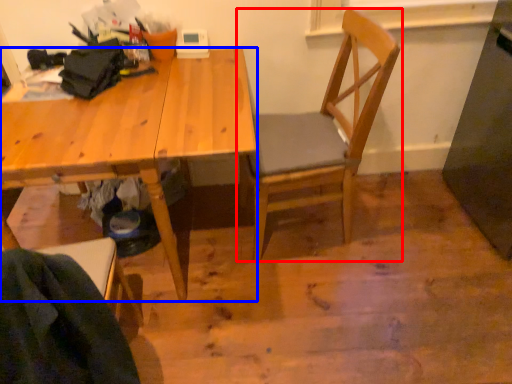
Question: Among these objects, which one is nearest to the camera, chair (highlighted by a red box) or desk (highlighted by a blue box)?

Choices:
 (A) chair
 (B) desk

Answer: (B)